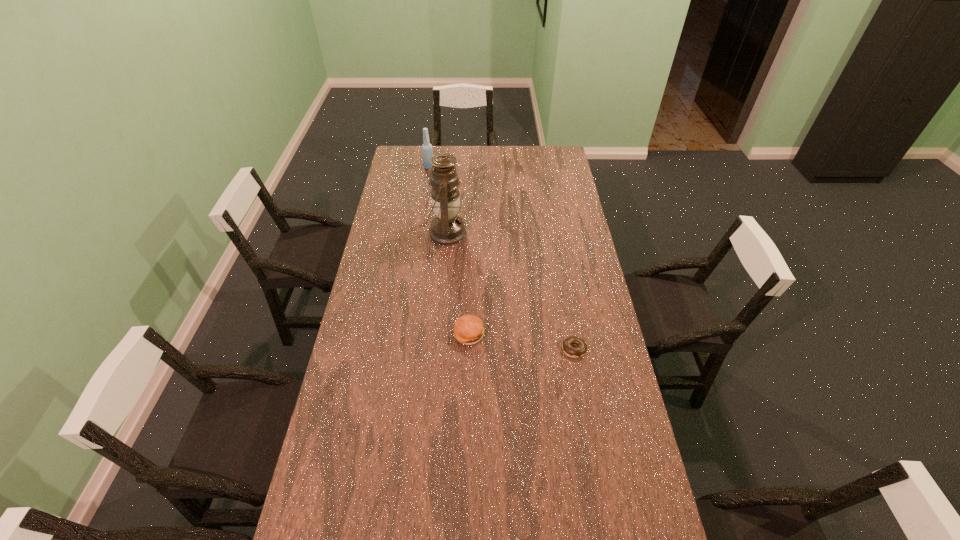
This screenshot has width=960, height=540. I want to click on vacant region located on the front of the rightmost object, so click(x=587, y=420).

Where is `object at the far edge`? object at the far edge is located at coordinates (427, 152).

Locate an element on the screen. object positioned at the left edge is located at coordinates (427, 152).

The image size is (960, 540). I want to click on object located in the right edge section of the desktop, so click(574, 352).

Locate an element on the screen. The image size is (960, 540). object present at the far left corner is located at coordinates (427, 152).

I want to click on free space at the far edge, so point(528,149).

You are a GUI agent. You are given a task and a screenshot of the screen. Output one action in this format:
    pyautogui.click(x=<x>, y=<y>)
    Task: Click on the vacant space at the left edge of the desktop
    This screenshot has height=540, width=960.
    Given the screenshot: What is the action you would take?
    pyautogui.click(x=338, y=501)

Identify the location of vacant space at the right edge. (629, 502).

What are the coordinates of `vacant space at the far left corner of the desktop` in the screenshot? It's located at (396, 148).

The image size is (960, 540). Find the location of `vacant space at the far right corner of the desktop`. vacant space at the far right corner of the desktop is located at coordinates (545, 154).